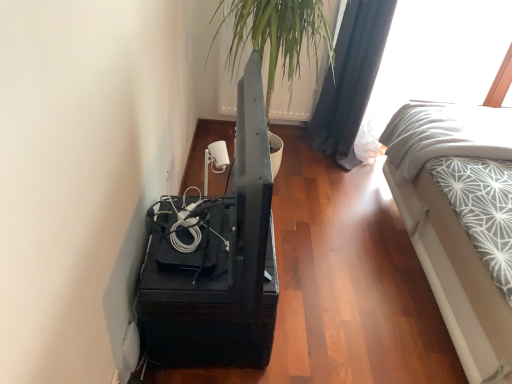
At what (x,y) coordinates should I click in order to perform the action: click on vacant area that is in front of black fabric curtain at upper right. Please return your answer as a coordinate pair (x, y). Image resolution: width=512 pixels, height=384 pixels. Looking at the image, I should click on (329, 169).